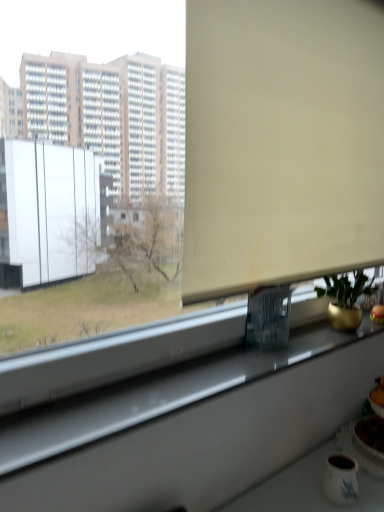
Question: Is gold metallic pot at right inside the boundaries of matte white mug at lower right, or outside?

Choices:
 (A) inside
 (B) outside

Answer: (B)

Question: Is gold metallic pot at right taller or shorter than matte white mug at lower right?

Choices:
 (A) short
 (B) tall

Answer: (B)

Question: Estimate the real-world distances between objects in this image. Which object is closer to the beige matte window screen at upper center?

Choices:
 (A) matte white mug at lower right
 (B) white glossy window sill at lower center
 (C) gold metallic pot at right

Answer: (C)

Question: Which object is the closest to the matte white mug at lower right?

Choices:
 (A) beige matte window screen at upper center
 (B) white glossy window sill at lower center
 (C) gold metallic pot at right

Answer: (B)